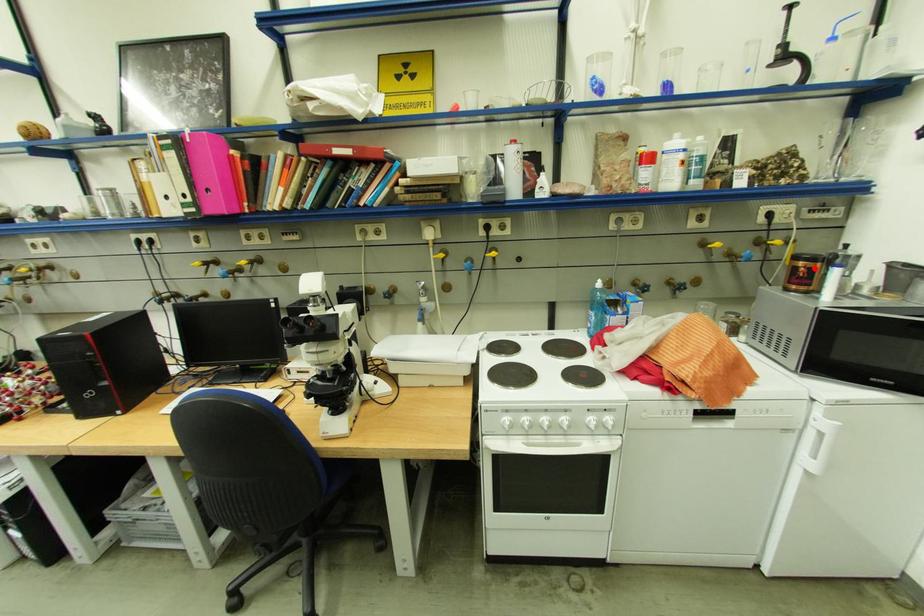
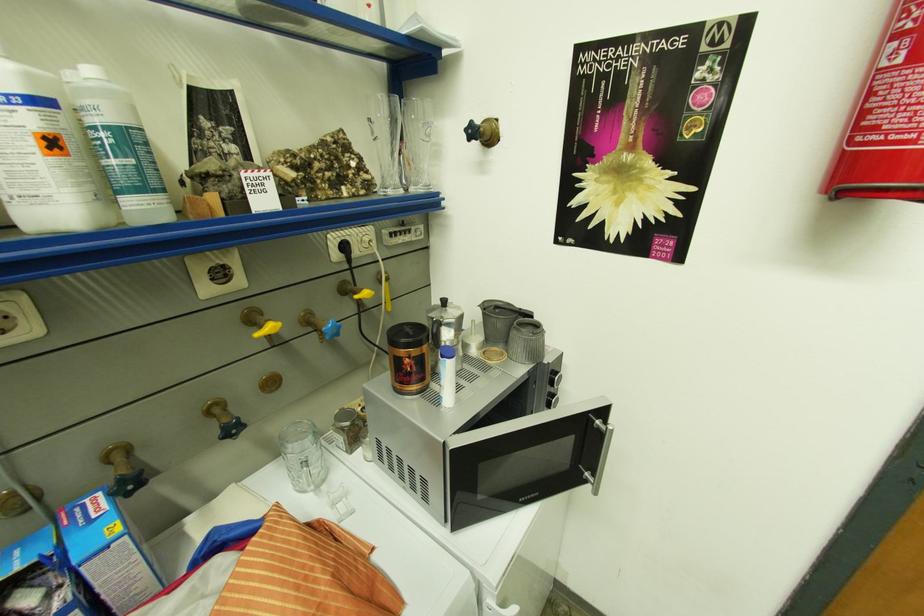
Where in the second image is the point corresponding to the highlighted location from the first image?

(419, 359)